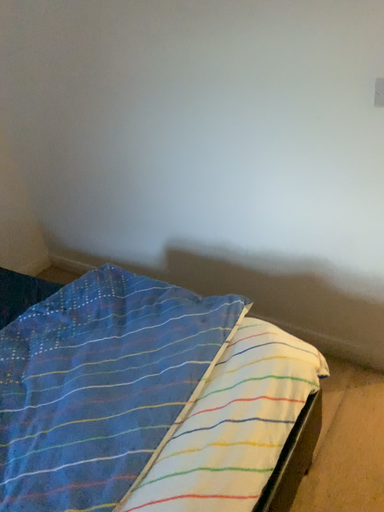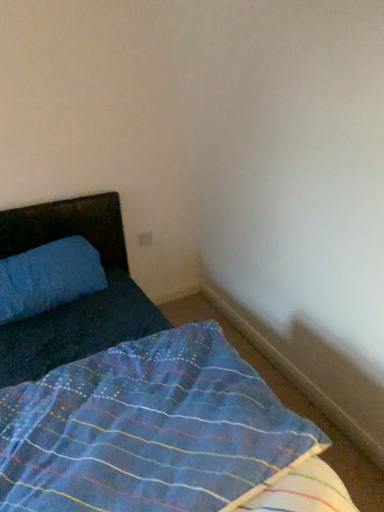
Question: Which way did the camera rotate in the video?

Choices:
 (A) rotated right
 (B) rotated left

Answer: (B)